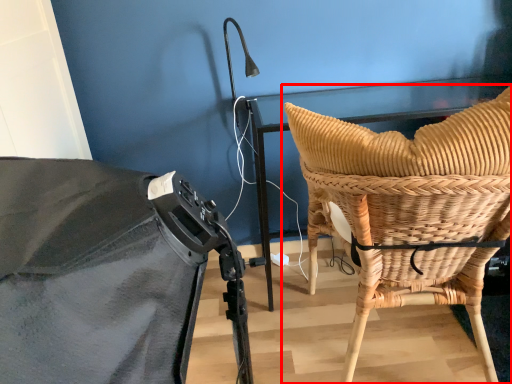
Question: From the image's perspective, where is chair (annotated by the red box) located relative to basket?

Choices:
 (A) above
 (B) below

Answer: (B)